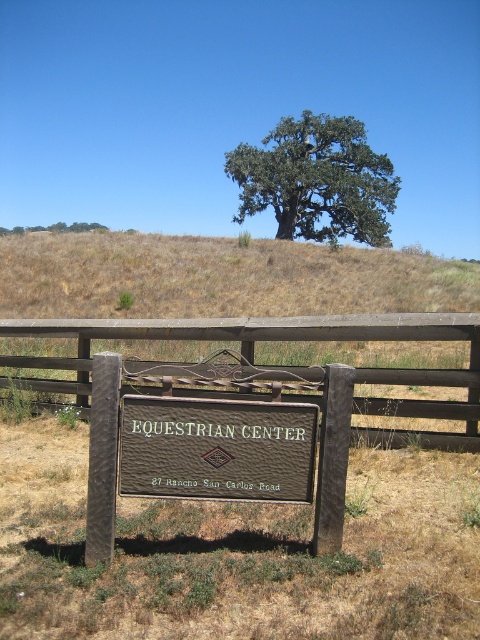
You are a hiker who wants to read the brown leather sign at center. However, you are currently standing behind the brown wooden fence at center. Can you read the sign without moving closer?

The brown wooden fence at center is positioned over the brown leather sign at center, so the fence is blocking your view. You will need to move closer to see the sign clearly.

You are standing at the edge of a field looking at the brown wooden fence at center. You want to place a 2.5 meter long ladder horizontally on the ground between you and the fence. Is there enough space for the ladder to fit without touching the fence?

The distance between you and the brown wooden fence at center is 6.39 meters. Since the ladder is only 2.5 meters long, there is sufficient space to place it horizontally between you and the fence without touching the fence.

You are a gardener who wants to place a new flowerpot between the brown wooden fence at center and the brown leather sign at center. The flowerpot is 3 feet wide. Is there enough space between them to place the flowerpot?

Answer: The brown wooden fence at center and brown leather sign at center are 8.94 feet apart. Since the flowerpot is 3 feet wide, there is enough space between them to place the flowerpot.